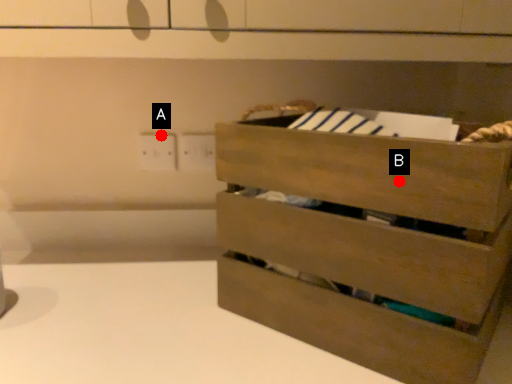
Question: Two points are circled on the image, labeled by A and B beside each circle. Which of the following is the farthest from the observer?

Choices:
 (A) A is further
 (B) B is further

Answer: (A)